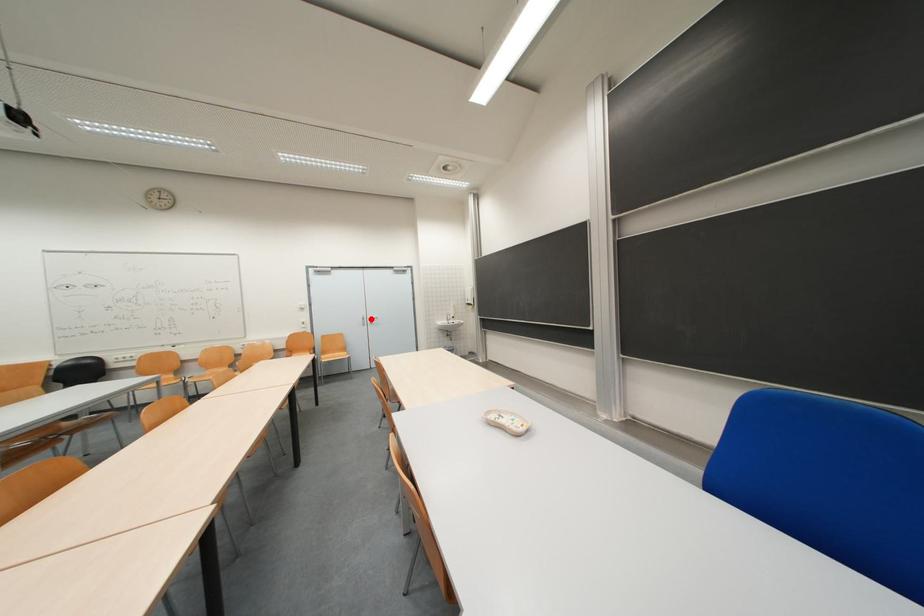
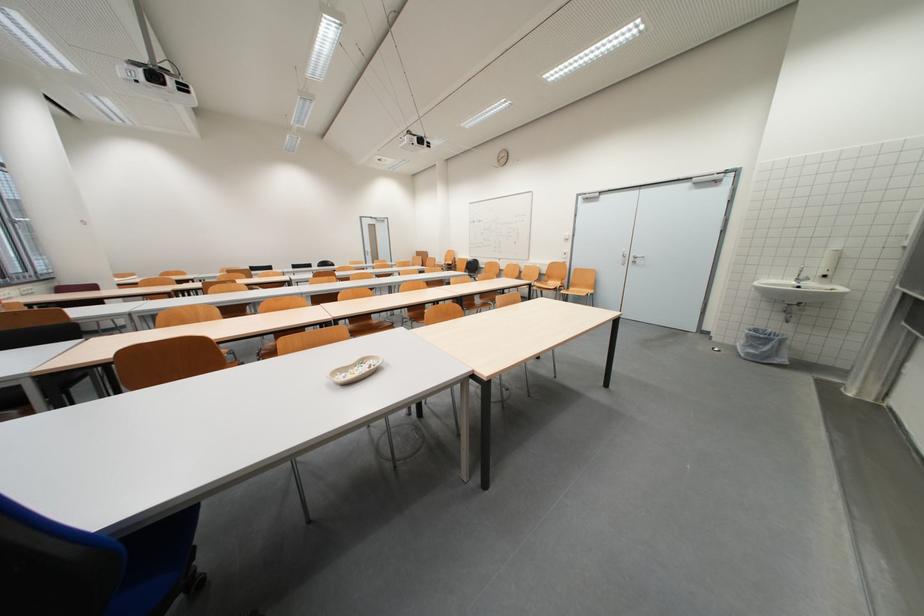
Question: I am providing you with two images of the same scene from different viewpoints. A red point is shown in image1. For the corresponding object point in image2, is it positioned nearer or farther from the camera?

Choices:
 (A) Nearer
 (B) Farther

Answer: (A)